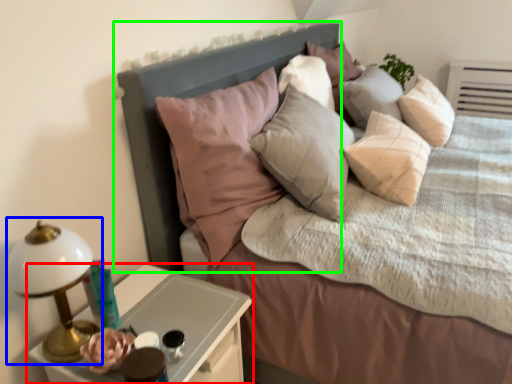
Question: Which is nearer to the nightstand (highlighted by a red box)? bedside lamp (highlighted by a blue box) or headboard (highlighted by a green box).

Choices:
 (A) bedside lamp
 (B) headboard

Answer: (A)